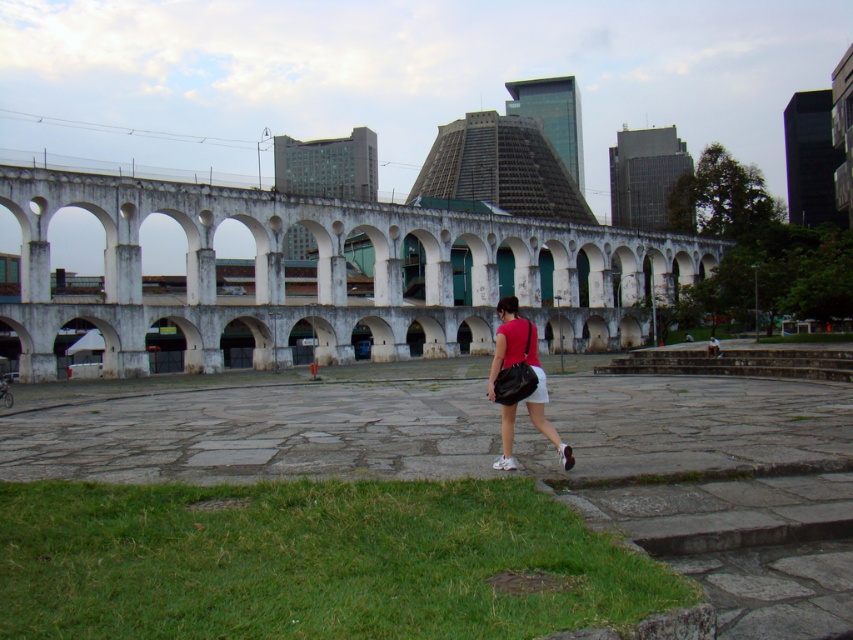
Question: Observing the image, what is the correct spatial positioning of green grass at lower left in reference to white cotton shorts at lower center?

Choices:
 (A) above
 (B) below

Answer: (B)

Question: Does matte black bag at center have a lesser width compared to white cotton shorts at lower center?

Choices:
 (A) yes
 (B) no

Answer: (B)

Question: Does green grass at lower left appear on the left side of matte black bag at center?

Choices:
 (A) yes
 (B) no

Answer: (A)

Question: Which object appears closest to the camera in this image?

Choices:
 (A) green grass at lower left
 (B) matte black bag at center

Answer: (A)

Question: Which of the following is the farthest from the observer?

Choices:
 (A) click(381, 611)
 (B) click(543, 392)
 (C) click(538, 371)

Answer: (C)

Question: Which object is farther from the camera taking this photo?

Choices:
 (A) green grass at lower left
 (B) white cotton shorts at lower center

Answer: (B)